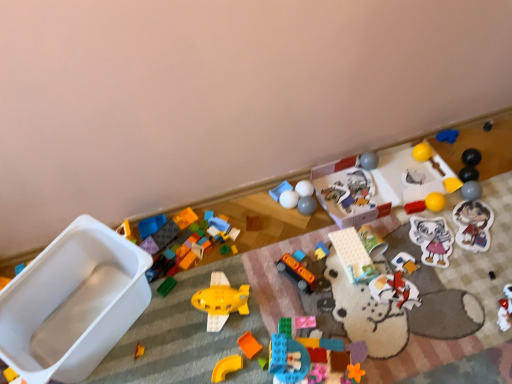
In order to click on unoccupied space behind pink matte block at center, acting as the 14th toy starting from the right in this screenshot , I will do `click(297, 281)`.